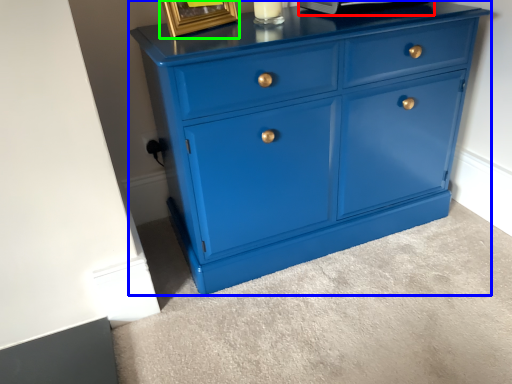
Question: Which is farther away from appliance (highlighted by a red box)? chest of drawers (highlighted by a blue box) or picture frame (highlighted by a green box)?

Choices:
 (A) chest of drawers
 (B) picture frame

Answer: (A)